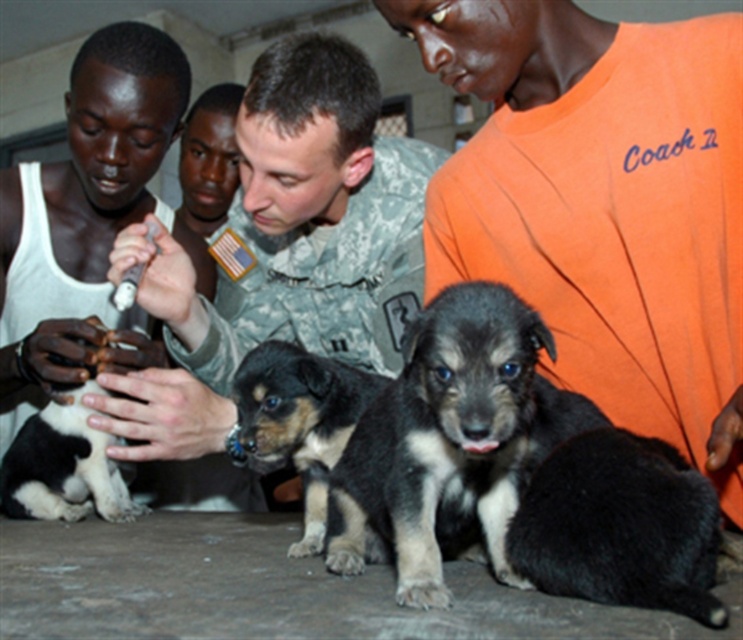
Question: Among these objects, which one is nearest to the camera?

Choices:
 (A) black and tan fur puppy at center
 (B) orange cotton shirt at upper right
 (C) black fur puppy at center
 (D) camouflage uniform at center

Answer: (C)

Question: Which of the following is the farthest from the observer?

Choices:
 (A) (588, 129)
 (B) (279, 54)
 (C) (438, 593)
 (D) (59, 452)

Answer: (D)

Question: Is orange cotton shirt at upper right positioned at the back of camouflage uniform at center?

Choices:
 (A) yes
 (B) no

Answer: (B)

Question: Is black and tan fur puppy at center behind black and white fur at center?

Choices:
 (A) yes
 (B) no

Answer: (B)

Question: Is black and tan fur puppy at center closer to camera compared to black and white fur at center?

Choices:
 (A) no
 (B) yes

Answer: (B)

Question: Which point is farther from the camera taking this photo?

Choices:
 (A) (6, 476)
 (B) (308, 484)
 (C) (504, 573)
 (D) (250, 84)

Answer: (A)